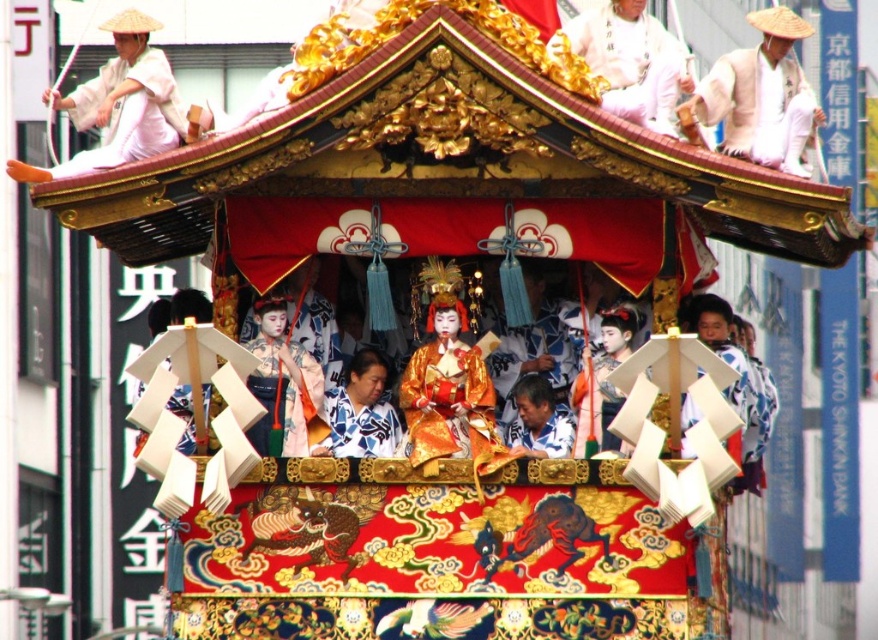
Who is positioned more to the left, matte gold mask at center or matte white shirt at center?

matte white shirt at center is more to the left.

Consider the image. Does matte gold mask at center lie behind matte white shirt at center?

Yes, matte gold mask at center is further from the viewer.

What do you see at coordinates (602, 385) in the screenshot?
I see `matte gold mask at center` at bounding box center [602, 385].

The height and width of the screenshot is (640, 878). What are the coordinates of `matte gold mask at center` in the screenshot? It's located at pos(602,385).

Who is lower down, matte pink kimono at center or blue and white kimono at center?

blue and white kimono at center is lower down.

Between point (301, 396) and point (342, 388), which one is positioned in front?

Positioned in front is point (301, 396).

Image resolution: width=878 pixels, height=640 pixels. What are the coordinates of `matte pink kimono at center` in the screenshot? It's located at click(x=283, y=385).

Does white cotton kimono at upper left appear on the left side of matte white shirt at center?

Yes, white cotton kimono at upper left is to the left of matte white shirt at center.

Which is below, white cotton kimono at upper left or matte white shirt at center?

matte white shirt at center is lower down.

You are a GUI agent. You are given a task and a screenshot of the screen. Output one action in this format:
    pyautogui.click(x=<x>, y=<y>)
    Task: Click on the white cotton kimono at upper left
    Image resolution: width=878 pixels, height=640 pixels.
    Given the screenshot: What is the action you would take?
    pyautogui.click(x=119, y=104)

The image size is (878, 640). What are the coordinates of `white cotton kimono at upper left` in the screenshot? It's located at (119, 104).